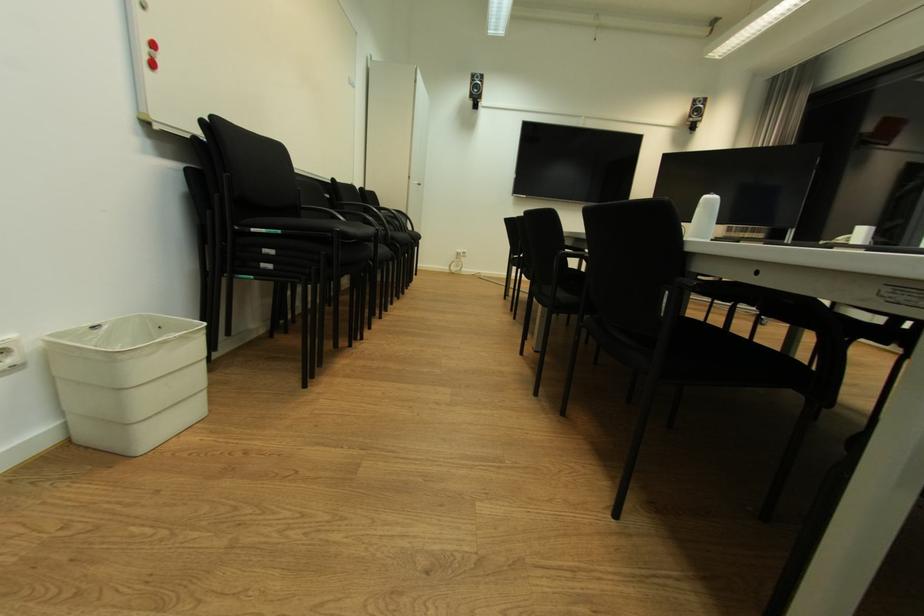
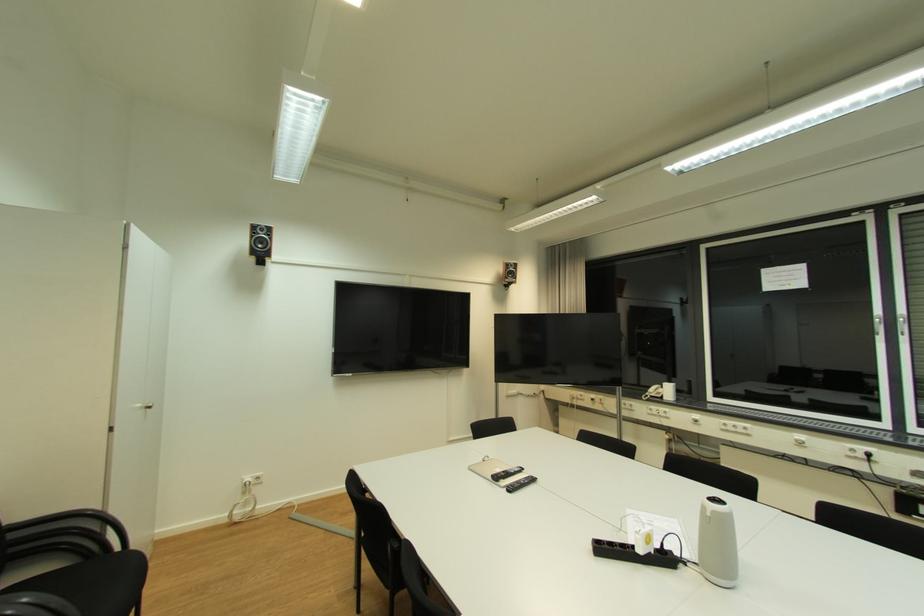
In the second image, find the point that corresponds to (421,182) in the first image.

(146, 407)